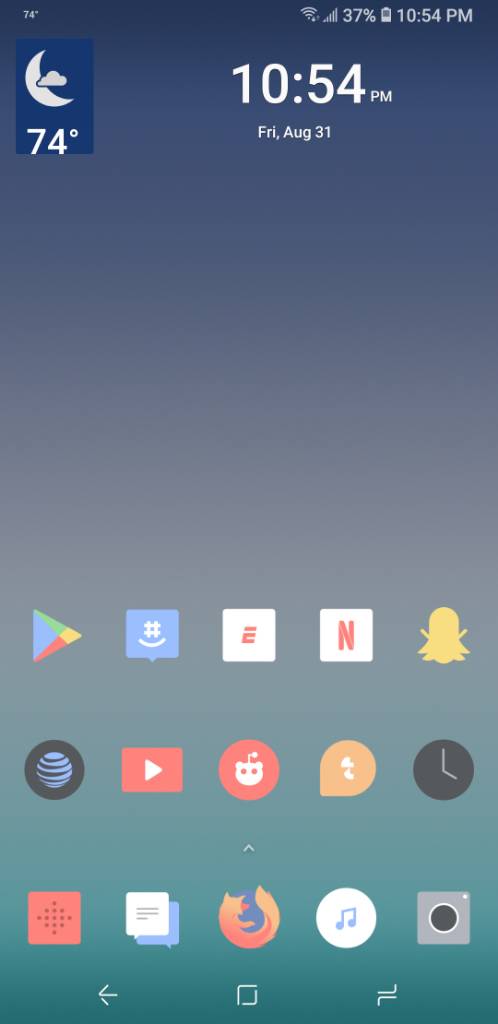
Find the location of a particular element. This screenshot has width=498, height=1024. clock face is located at coordinates (446, 765).